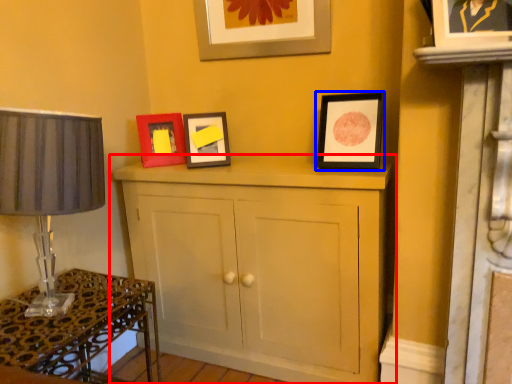
Question: Which of the following is the farthest to the observer, cupboard (highlighted by a red box) or picture frame (highlighted by a blue box)?

Choices:
 (A) cupboard
 (B) picture frame

Answer: (B)